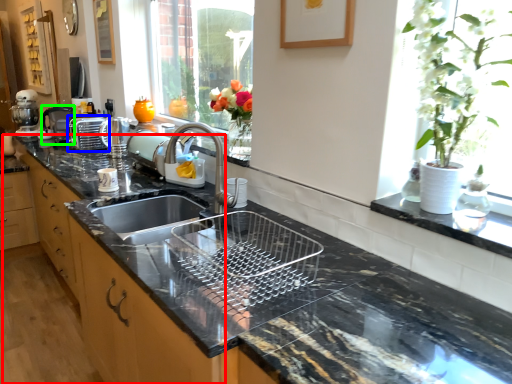
Question: Which object is positioned farthest from cabinetry (highlighted by a red box)? Select from appliance (highlighted by a blue box) and coffee machine (highlighted by a green box).

Choices:
 (A) appliance
 (B) coffee machine

Answer: (B)